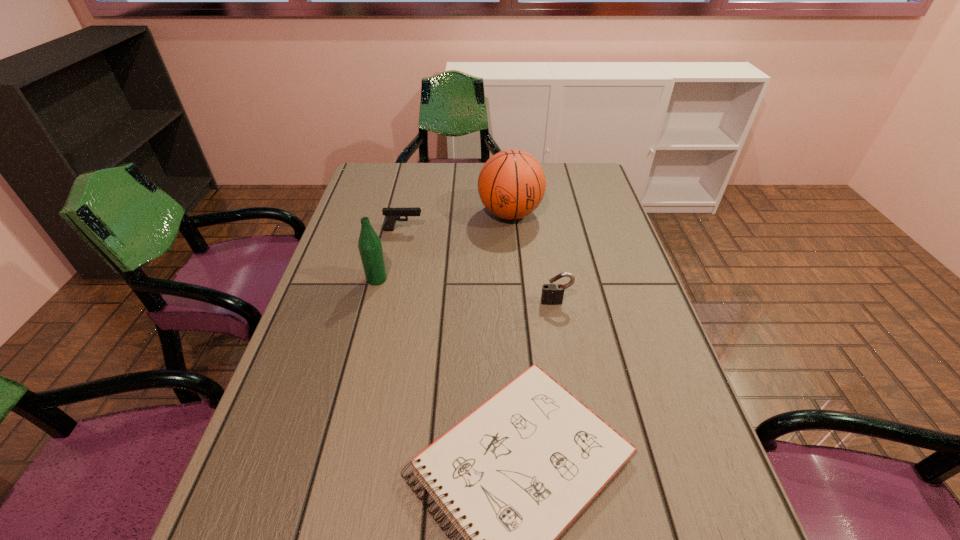
At what (x,y) coordinates should I click in order to perform the action: click on basketball. Please return your answer as a coordinate pair (x, y). This screenshot has height=540, width=960. Looking at the image, I should click on (511, 184).

The image size is (960, 540). In order to click on bottle in this screenshot , I will do `click(370, 247)`.

This screenshot has width=960, height=540. Find the location of `the fourth farthest object`. the fourth farthest object is located at coordinates (552, 294).

This screenshot has width=960, height=540. Identify the location of the third shortest object. (552, 294).

At what (x,y) coordinates should I click in order to perform the action: click on pistol. Please return your answer as a coordinate pair (x, y). Looking at the image, I should click on (392, 214).

Locate an element on the screen. Image resolution: width=960 pixels, height=540 pixels. free spot located on the front of the basketball is located at coordinates (518, 301).

Locate an element on the screen. free space located 0.350m on the back of the third farthest object is located at coordinates (396, 202).

The width and height of the screenshot is (960, 540). I want to click on vacant region located with the keyhole on the front of the padlock, so click(x=582, y=446).

The width and height of the screenshot is (960, 540). I want to click on vacant point located 0.400m on the front-facing side of the second shortest object, so click(555, 230).

You are a GUI agent. You are given a task and a screenshot of the screen. Output one action in this format:
    pyautogui.click(x=<x>, y=<y>)
    Task: Click on the object that is at the far edge
    Image resolution: width=960 pixels, height=540 pixels.
    Given the screenshot: What is the action you would take?
    pyautogui.click(x=511, y=184)